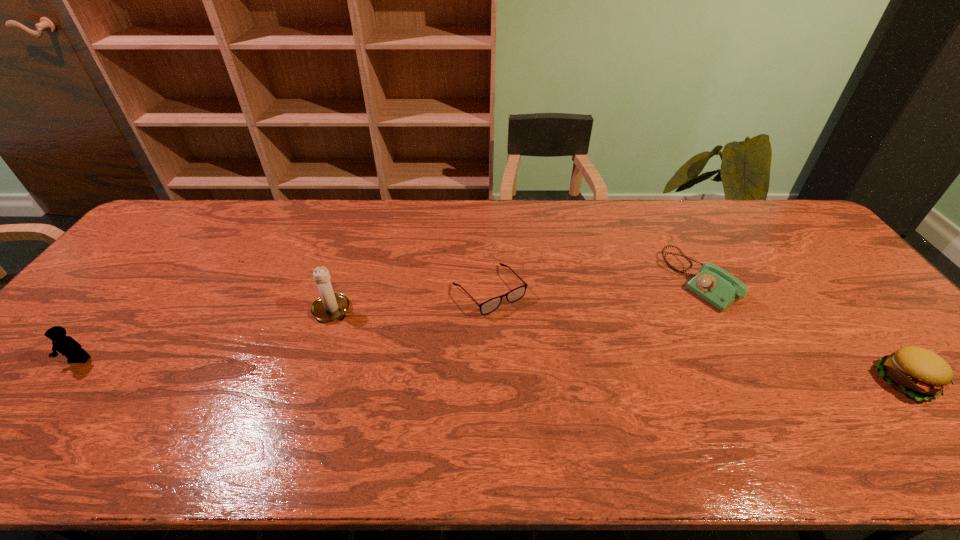
Identify the location of the leftmost object. (67, 346).

The height and width of the screenshot is (540, 960). What are the coordinates of `Lego` in the screenshot? It's located at (67, 346).

Find the location of `the rightmost object`. the rightmost object is located at coordinates (917, 372).

At what (x,y) coordinates should I click in order to perform the action: click on spectacles. Please return your answer as a coordinate pair (x, y). The height and width of the screenshot is (540, 960). Looking at the image, I should click on (490, 305).

Where is `the shortest object`? The width and height of the screenshot is (960, 540). the shortest object is located at coordinates (490, 305).

The height and width of the screenshot is (540, 960). Find the location of `candle holder`. candle holder is located at coordinates (330, 306).

The height and width of the screenshot is (540, 960). In order to click on the tallest object in this screenshot , I will do `click(330, 306)`.

You are a GUI agent. You are given a task and a screenshot of the screen. Output one action in this format:
    pyautogui.click(x=<x>, y=<y>)
    Task: Click on the telephone
    This screenshot has width=960, height=540.
    Given the screenshot: What is the action you would take?
    pyautogui.click(x=713, y=284)

The height and width of the screenshot is (540, 960). What are the coordinates of `the fourth object from left to right` in the screenshot? It's located at (713, 284).

I want to click on vacant space located on the front-facing side of the Lego, so click(x=50, y=397).